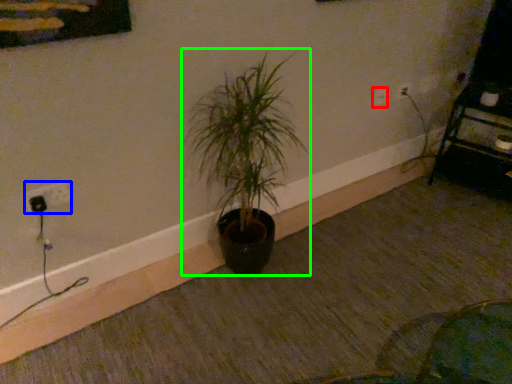
Question: Which object is positioned farthest from electric outlet (highlighted by a red box)? Select from electric outlet (highlighted by a blue box) and houseplant (highlighted by a green box).

Choices:
 (A) electric outlet
 (B) houseplant

Answer: (A)